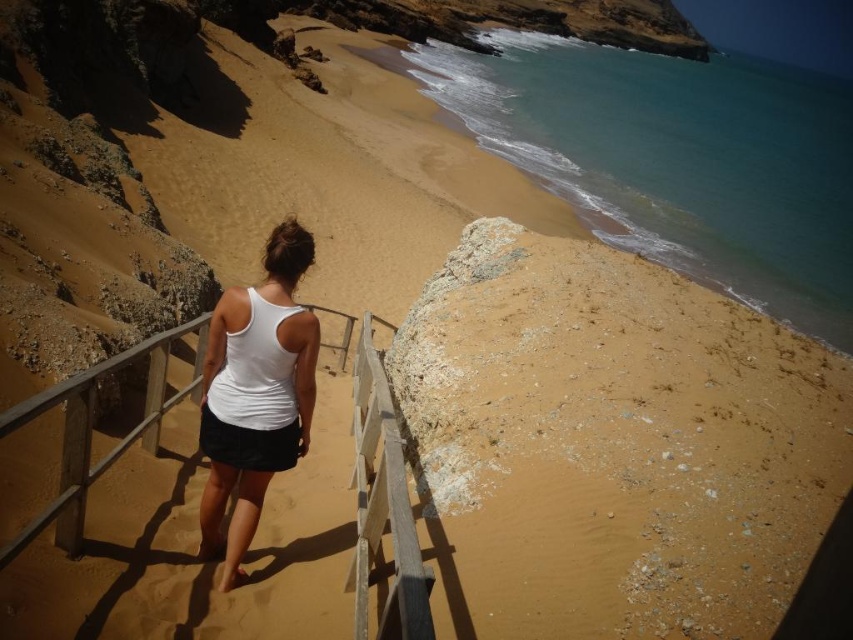
Can you confirm if brown sandy beach at center is positioned below white matte tank top at center?

Correct, brown sandy beach at center is located below white matte tank top at center.

The image size is (853, 640). I want to click on brown sandy beach at center, so click(618, 440).

Image resolution: width=853 pixels, height=640 pixels. Identify the location of brown sandy beach at center. (618, 440).